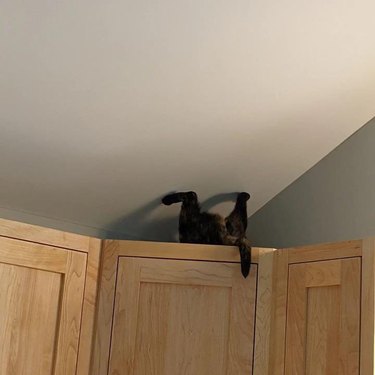
Identify the location of cabinet door. The height and width of the screenshot is (375, 375). (61, 266).